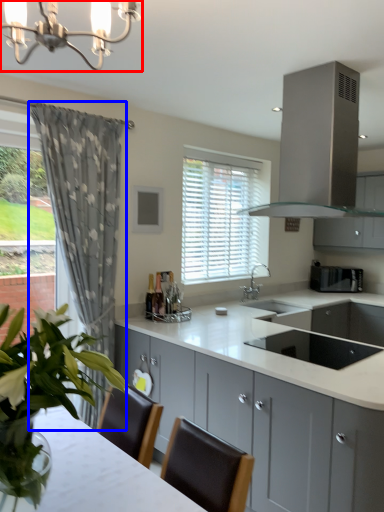
Question: Which of the following is the farthest to the observer, light fixture (highlighted by a red box) or curtain (highlighted by a blue box)?

Choices:
 (A) light fixture
 (B) curtain

Answer: (B)